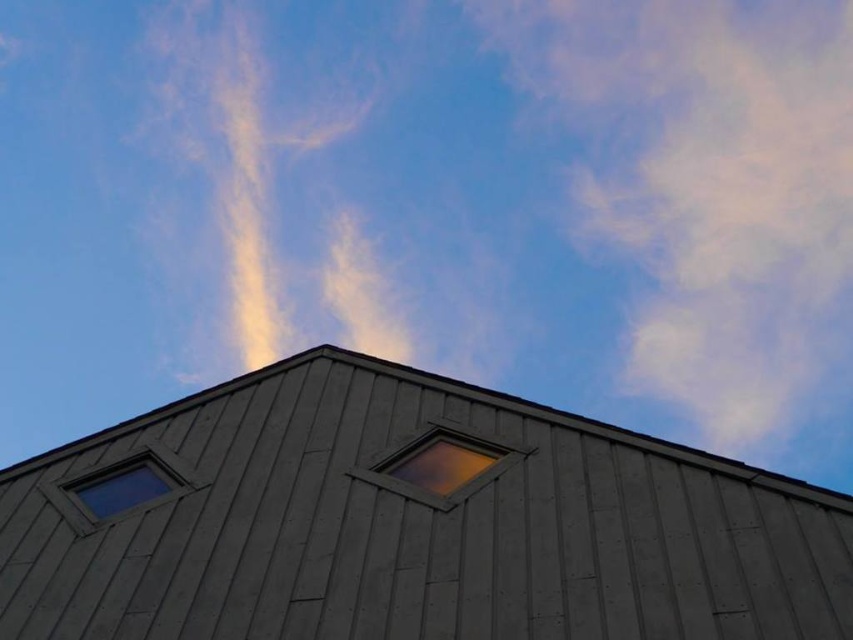
Question: Which point appears farthest from the camera in this image?

Choices:
 (A) (712, 518)
 (B) (83, 525)
 (C) (448, 433)

Answer: (C)

Question: Which of the following is the farthest from the observer?

Choices:
 (A) matte wooden window at center
 (B) gray wood roof at center
 (C) transparent glass window at lower left

Answer: (C)

Question: Can you confirm if gray wood roof at center is bigger than matte wooden window at center?

Choices:
 (A) yes
 (B) no

Answer: (A)

Question: Is gray wood roof at center closer to camera compared to matte wooden window at center?

Choices:
 (A) no
 (B) yes

Answer: (B)

Question: Among these objects, which one is nearest to the camera?

Choices:
 (A) transparent glass window at lower left
 (B) matte wooden window at center

Answer: (B)

Question: Is gray wood roof at center to the right of transparent glass window at lower left from the viewer's perspective?

Choices:
 (A) yes
 (B) no

Answer: (A)